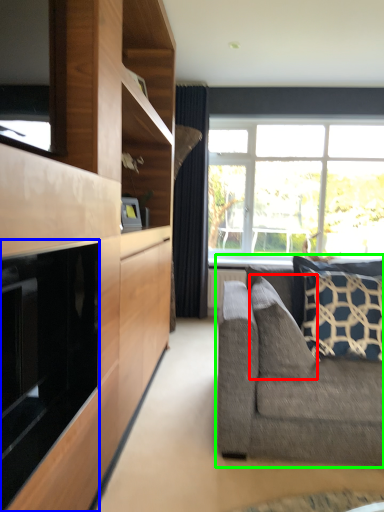
Question: Estimate the real-world distances between objects in this image. Which object is closer to pillow (highlighted by a red box), fireplace (highlighted by a blue box) or studio couch (highlighted by a green box)?

Choices:
 (A) fireplace
 (B) studio couch

Answer: (B)